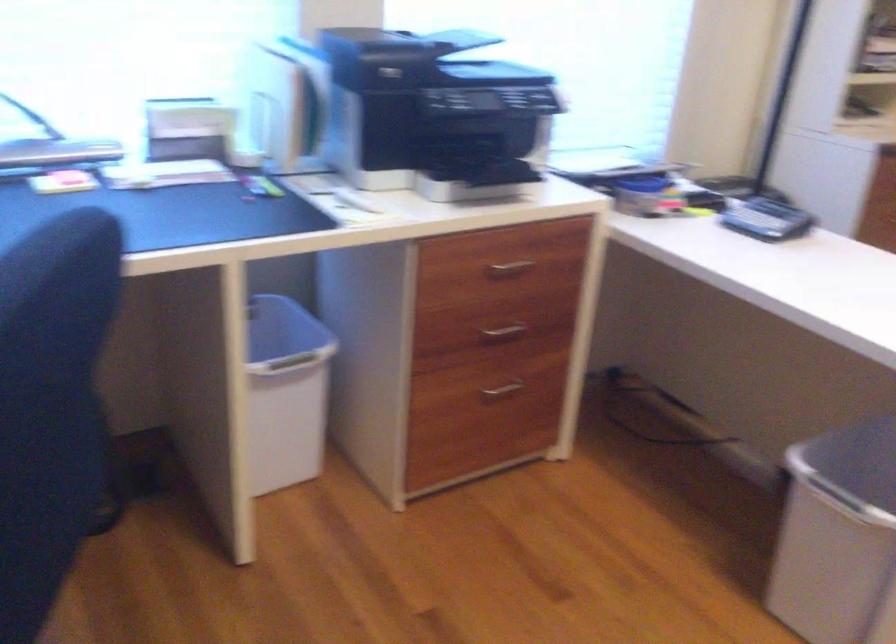
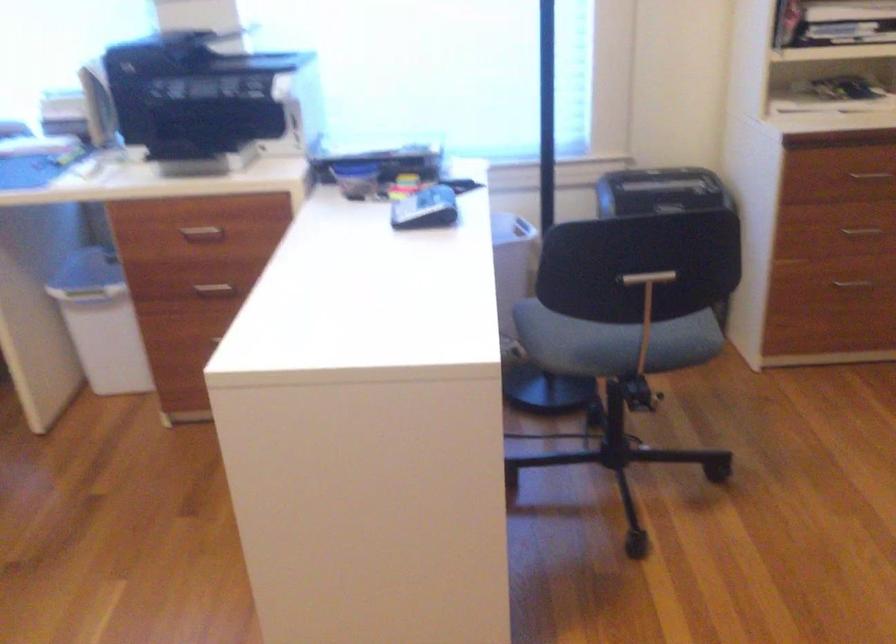
Question: Which direction would the cameraman need to move to produce the second image? Reply with the corresponding letter.

Choices:
 (A) Left
 (B) Right
 (C) Forward
 (D) Backward

Answer: (B)